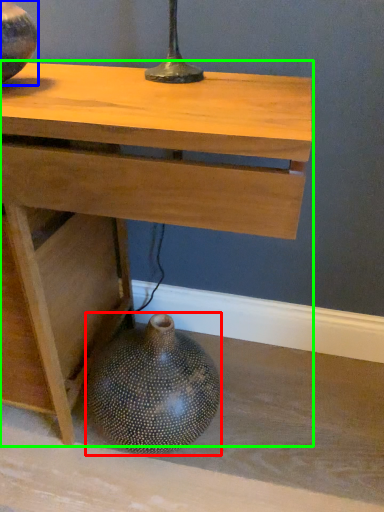
Question: Which object is the closest to the vase (highlighted by a red box)? Choose among these: vase (highlighted by a blue box) or table (highlighted by a green box).

Choices:
 (A) vase
 (B) table

Answer: (B)